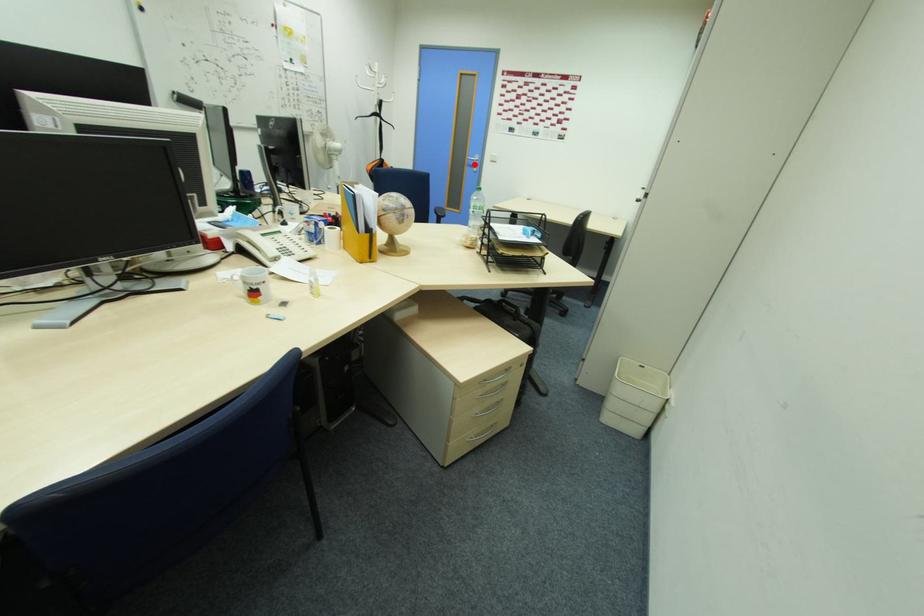
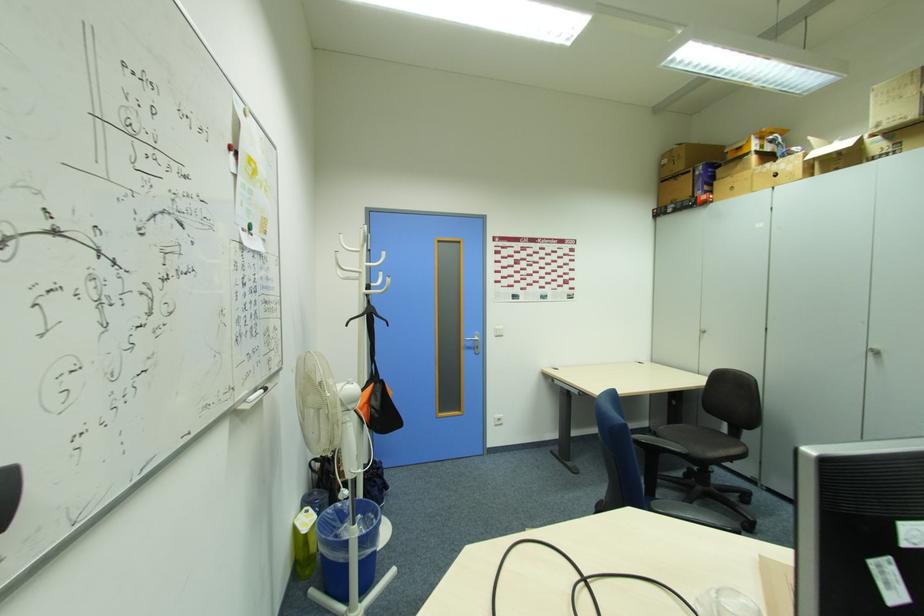
Find the pixel in the second image that matches the highlighted location in the first image.

(472, 346)